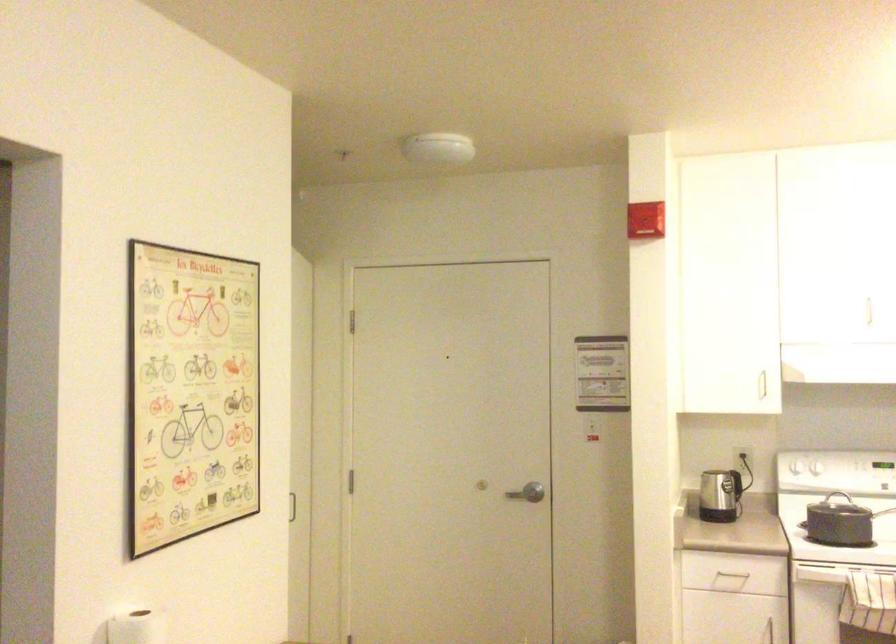
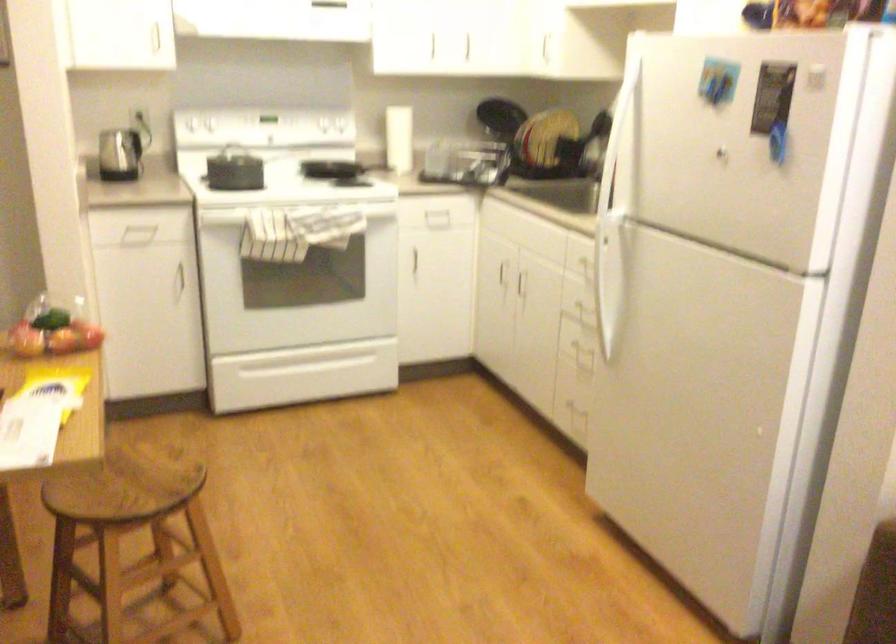
In the second image, find the point that corresponds to point 811,468 in the first image.

(200, 122)